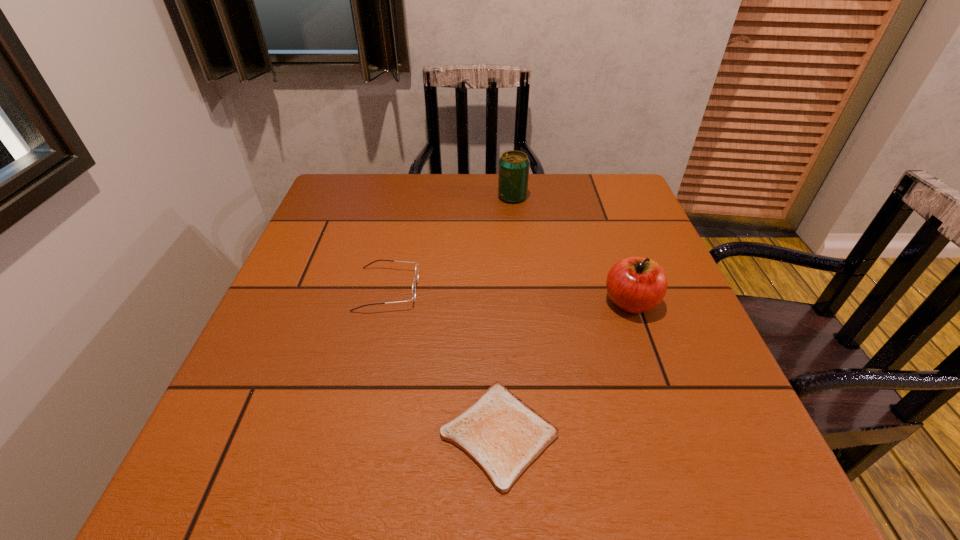
Select which object is the third closest to the beer can. Please provide its 2D coordinates. Your answer should be formatted as a tuple, i.e. [(x, y)], where the tuple contains the x and y coordinates of a point satisfying the conditions above.

[(503, 435)]

Where is `free location that satisfies the following two spatial constraints: 1. through the lenses of the second shortest object; 2. on the back side of the apple`? free location that satisfies the following two spatial constraints: 1. through the lenses of the second shortest object; 2. on the back side of the apple is located at coordinates (385, 302).

Image resolution: width=960 pixels, height=540 pixels. I want to click on free space that satisfies the following two spatial constraints: 1. through the lenses of the spectacles; 2. on the back side of the apple, so click(x=385, y=302).

Identify the location of free region that satisfies the following two spatial constraints: 1. through the lenses of the rightmost object; 2. on the right side of the leftmost object. (385, 302).

Locate an element on the screen. vacant space that satisfies the following two spatial constraints: 1. through the lenses of the apple; 2. on the left side of the leftmost object is located at coordinates (385, 302).

What are the coordinates of `free space that satisfies the following two spatial constraints: 1. through the lenses of the spectacles; 2. on the back side of the shortest object` in the screenshot? It's located at (355, 434).

Where is `vacant point that satisfies the following two spatial constraints: 1. through the lenses of the spectacles; 2. on the right side of the shortest object`? vacant point that satisfies the following two spatial constraints: 1. through the lenses of the spectacles; 2. on the right side of the shortest object is located at coordinates click(x=355, y=434).

This screenshot has width=960, height=540. Identify the location of free space in the image that satisfies the following two spatial constraints: 1. through the lenses of the spectacles; 2. on the left side of the apple. (385, 302).

Where is `vacant space that satisfies the following two spatial constraints: 1. through the lenses of the leftmost object; 2. on the right side of the shortest object`? This screenshot has height=540, width=960. vacant space that satisfies the following two spatial constraints: 1. through the lenses of the leftmost object; 2. on the right side of the shortest object is located at coordinates (355, 434).

This screenshot has width=960, height=540. I want to click on blank space that satisfies the following two spatial constraints: 1. through the lenses of the spectacles; 2. on the back side of the rightmost object, so click(385, 302).